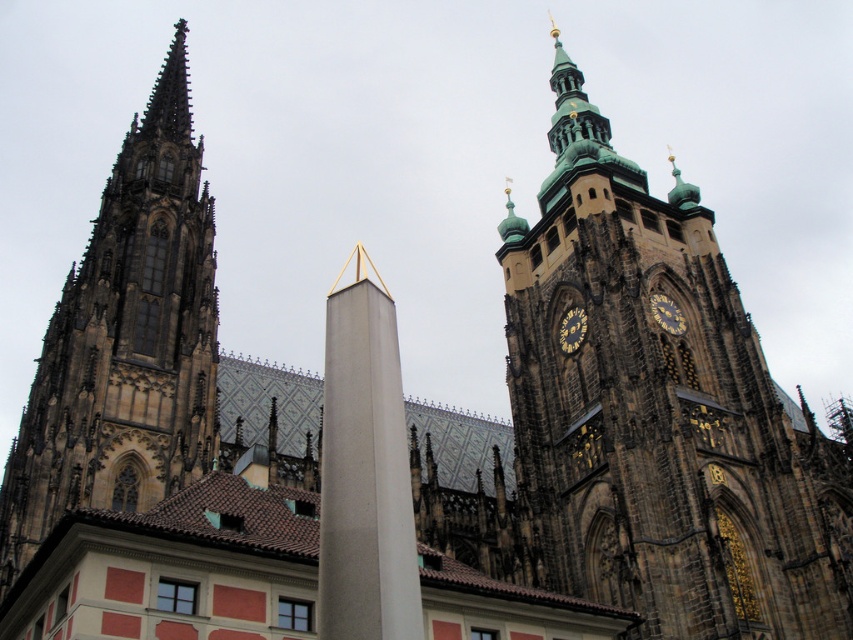
Does point (561, 317) come behind point (651, 294)?

Yes, it is.

Who is more forward, (x=582, y=330) or (x=660, y=324)?

Point (x=660, y=324)

Where is `gold metallic clock at center-right`? The height and width of the screenshot is (640, 853). gold metallic clock at center-right is located at coordinates (572, 330).

Between dark brown stone tower at upper center and gold metallic clock at center-right, which one has less height?

With less height is gold metallic clock at center-right.

Can you confirm if dark brown stone tower at upper center is bigger than gold metallic clock at center-right?

Correct, dark brown stone tower at upper center is larger in size than gold metallic clock at center-right.

Does point (701, 573) come in front of point (564, 332)?

Yes, it is.

Identify the location of dark brown stone tower at upper center. This screenshot has height=640, width=853. (656, 413).

At what (x,y) coordinates should I click in order to perform the action: click on dark brown stone tower at upper center. Please return your answer as a coordinate pair (x, y). The width and height of the screenshot is (853, 640). Looking at the image, I should click on (656, 413).

Is dark brown stone tower at upper center positioned before brown stone tower at left?

No.

This screenshot has height=640, width=853. Find the location of `dark brown stone tower at upper center`. dark brown stone tower at upper center is located at coordinates (656, 413).